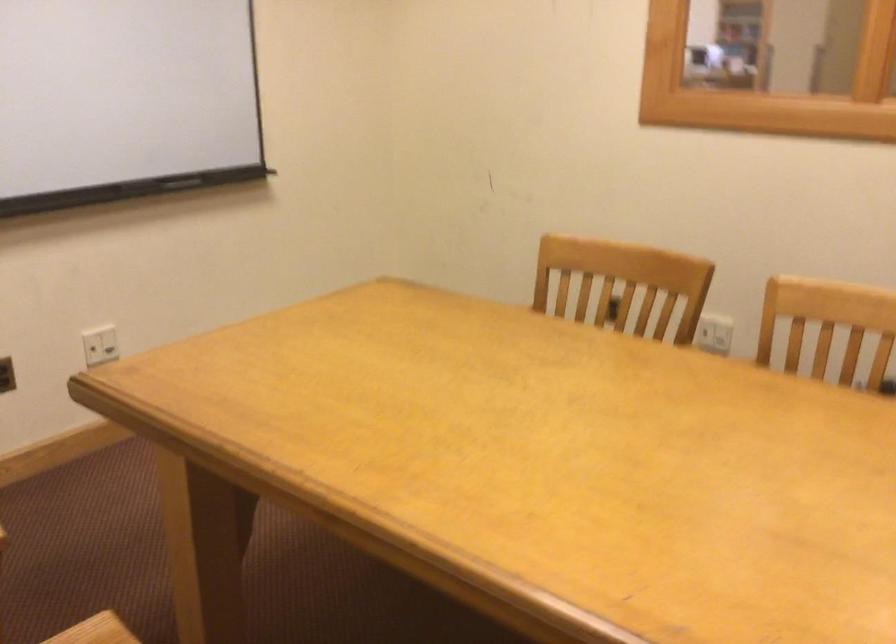
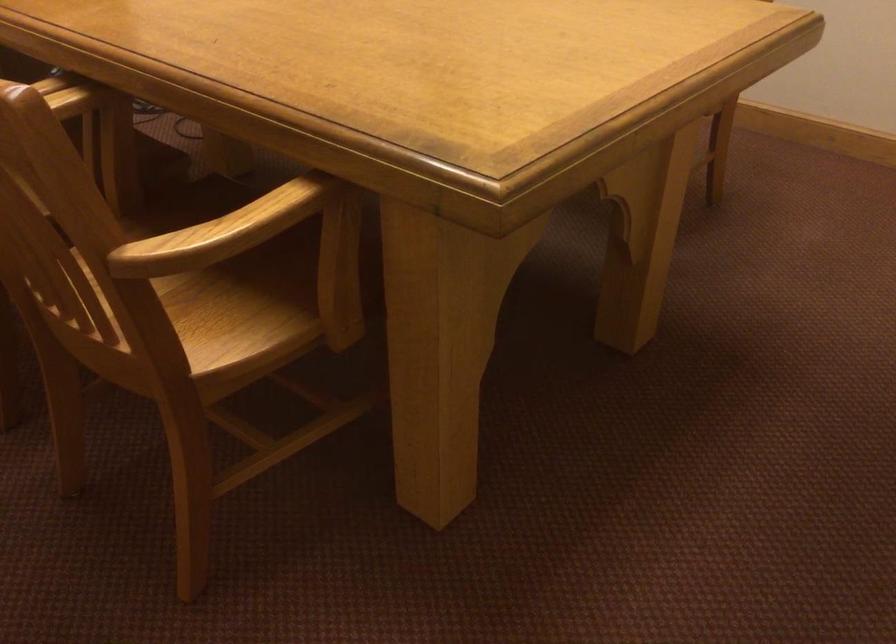
In the second image, find the point that corresponds to point 481,313 in the first image.

(221, 232)